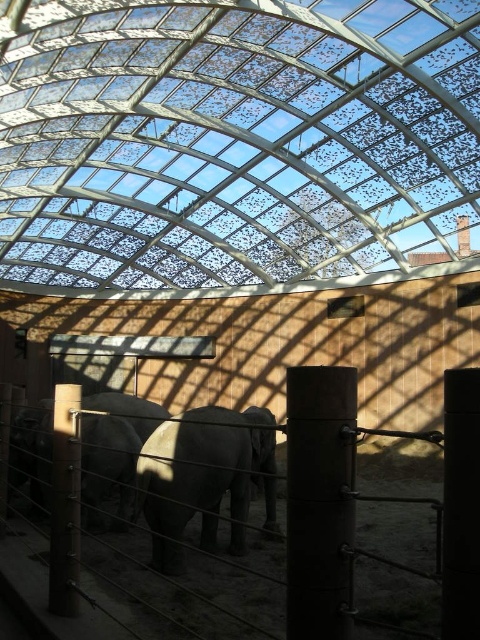
You are standing in the elephant enclosure and want to take a photo of the point at coordinates [204,486]. If the camera you are using has a maximum focus range of 25 feet, will it be able to focus on that point?

The point at coordinates [204,486] is 23.24 feet away from the viewer. Since the camera can focus up to 25 feet, it will be able to focus on the point.